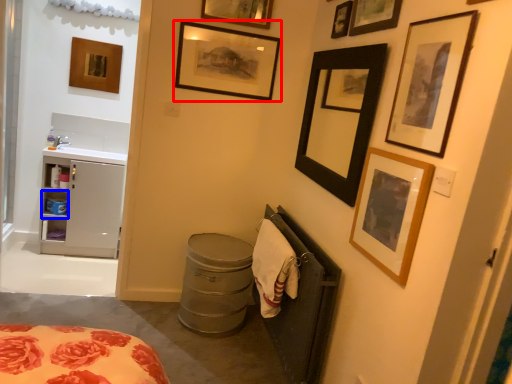
Question: Which of the following is the farthest to the observer, picture frame (highlighted by a red box) or cabinet (highlighted by a blue box)?

Choices:
 (A) picture frame
 (B) cabinet

Answer: (B)